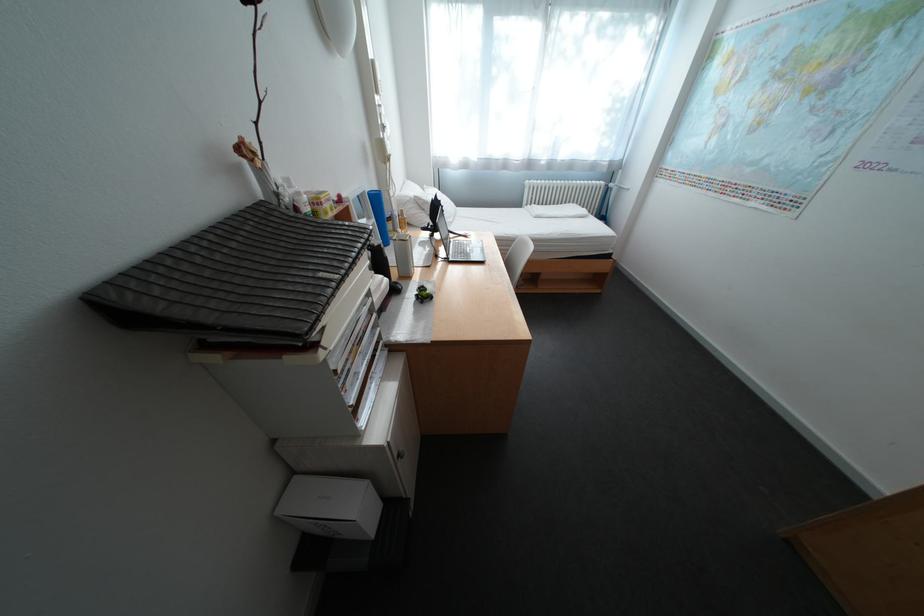
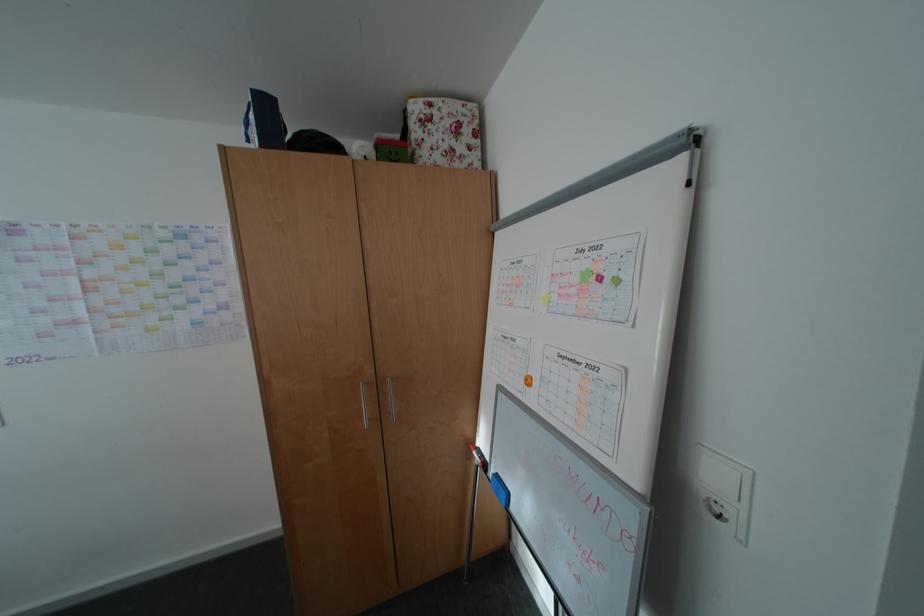
The first image is from the beginning of the video and the second image is from the end. How did the camera likely rotate when shooting the video?

The camera's rotation is toward right-down.